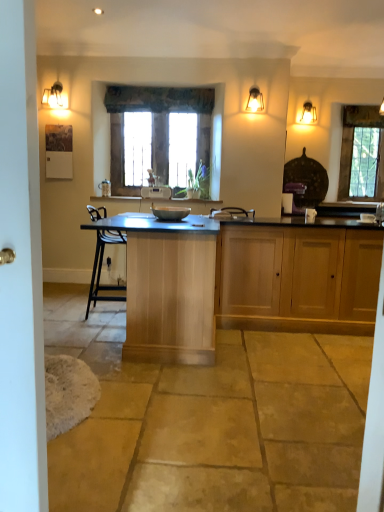
The width and height of the screenshot is (384, 512). Describe the element at coordinates (173, 137) in the screenshot. I see `wooden frame at center, the first window positioned from the left` at that location.

The height and width of the screenshot is (512, 384). Describe the element at coordinates (54, 97) in the screenshot. I see `matte brass sconce at upper left, which is the 2th light fixture from back to front` at that location.

Find the location of `matte black bowl at center`. matte black bowl at center is located at coordinates (170, 213).

What do you see at coordinates (298, 279) in the screenshot? The height and width of the screenshot is (512, 384). I see `wooden cabinet at center, the second cabinetry when ordered from left to right` at bounding box center [298, 279].

This screenshot has width=384, height=512. I want to click on satin nickel faucet at right, so click(x=380, y=213).

What do you see at coordinates (380, 213) in the screenshot? I see `satin nickel faucet at right` at bounding box center [380, 213].

Locate an element on the screen. wooden frame at center, which appears as the 2th window when viewed from the right is located at coordinates (173, 137).

Is wooden frame at center, marked as the 2th window in a back-to-front arrangement, to the left or to the right of light wood cabinet at center, acting as the second cabinetry starting from the right, in the image?

Clearly, wooden frame at center, marked as the 2th window in a back-to-front arrangement, is on the left of light wood cabinet at center, acting as the second cabinetry starting from the right, in the image.

Considering the sizes of objects wooden frame at center, the first window positioned from the left, and light wood cabinet at center, acting as the second cabinetry starting from the right, in the image provided, who is smaller, wooden frame at center, the first window positioned from the left, or light wood cabinet at center, acting as the second cabinetry starting from the right,?

Smaller between the two is wooden frame at center, the first window positioned from the left.

Is wooden frame at center, marked as the 2th window in a back-to-front arrangement, next to matte black bowl at center?

wooden frame at center, marked as the 2th window in a back-to-front arrangement, and matte black bowl at center are clearly separated.

From a real-world perspective, is wooden frame at center, the first window positioned from the left, located beneath matte black bowl at center?

No, from a real-world perspective, wooden frame at center, the first window positioned from the left, is not under matte black bowl at center.

From the image's perspective, between wooden frame at center, the first window positioned from the left, and matte black bowl at center, who is located below?

From the image's view, matte black bowl at center is below.

Between wooden frame at center, which appears as the 2th window when viewed from the right, and matte black bowl at center, which one has smaller size?

matte black bowl at center is smaller.

How many degrees apart are the facing directions of wooden cabinet at center, the second cabinetry when ordered from left to right, and matte brass sconce at upper left, which is the 2th light fixture from back to front?

The angular difference between wooden cabinet at center, the second cabinetry when ordered from left to right, and matte brass sconce at upper left, which is the 2th light fixture from back to front, is 1.49 degrees.

From the image's perspective, is wooden cabinet at center, the second cabinetry when ordered from left to right, positioned above or below matte brass sconce at upper left, which is the third light fixture from right to left?

From the image's perspective, wooden cabinet at center, the second cabinetry when ordered from left to right, appears below matte brass sconce at upper left, which is the third light fixture from right to left.

Is wooden cabinet at center, the second cabinetry when ordered from left to right, situated inside matte brass sconce at upper left, acting as the first light fixture starting from the left, or outside?

wooden cabinet at center, the second cabinetry when ordered from left to right, is not enclosed by matte brass sconce at upper left, acting as the first light fixture starting from the left.

The image size is (384, 512). There is a wooden cabinet at center, arranged as the 1th cabinetry when viewed from the right. In order to click on the 2nd light fixture above it (from a real-world perspective) in this screenshot , I will do `click(54, 97)`.

Between clear glass window at right, acting as the 2th window starting from the left, and matte brass light fixture at upper right, the 2th light fixture from the right, which one has larger size?

clear glass window at right, acting as the 2th window starting from the left.

Starting from the clear glass window at right, the 2th window in the front-to-back sequence, which light fixture is the 3rd one in front? Please provide its 2D coordinates.

[(255, 100)]

Is clear glass window at right, the 2th window in the front-to-back sequence, directly adjacent to matte brass light fixture at upper right, the 2th light fixture viewed from the left?

clear glass window at right, the 2th window in the front-to-back sequence, is not next to matte brass light fixture at upper right, the 2th light fixture viewed from the left, and they're not touching.

Considering the relative positions of clear glass window at right, the 1th window from the back, and matte brass light fixture at upper right, marked as the 1th light fixture in a front-to-back arrangement, in the image provided, is clear glass window at right, the 1th window from the back, behind matte brass light fixture at upper right, marked as the 1th light fixture in a front-to-back arrangement,?

Yes, clear glass window at right, the 1th window from the back, is behind matte brass light fixture at upper right, marked as the 1th light fixture in a front-to-back arrangement.

Is point (7, 501) closer or farther from the camera than point (354, 158)?

Point (7, 501) is positioned closer to the camera compared to point (354, 158).

Which object is wider, white glossy door at left or clear glass window at right, the 2th window in the front-to-back sequence?

white glossy door at left is wider.

Measure the distance from white glossy door at left to clear glass window at right, acting as the 2th window starting from the left.

A distance of 5.47 meters exists between white glossy door at left and clear glass window at right, acting as the 2th window starting from the left.

From the image's perspective, is white glossy door at left located above or below clear glass window at right, the 2th window in the front-to-back sequence?

From the image's perspective, white glossy door at left appears below clear glass window at right, the 2th window in the front-to-back sequence.

From a real-world perspective, is satin nickel faucet at right located higher than matte brass sconce at upper left, which is the 2th light fixture from back to front?

No.

Is point (383, 204) less distant than point (56, 96)?

Yes, it is in front of point (56, 96).

Which of these two, satin nickel faucet at right or matte brass sconce at upper left, which is the 2th light fixture from back to front, stands shorter?

satin nickel faucet at right is shorter.

Between satin nickel faucet at right and matte brass sconce at upper left, acting as the second light fixture starting from the front, which one appears on the left side from the viewer's perspective?

matte brass sconce at upper left, acting as the second light fixture starting from the front.

Are satin nickel faucet at right and wooden frame at center, the first window positioned from the left, making contact?

There is a gap between satin nickel faucet at right and wooden frame at center, the first window positioned from the left.

From a real-world perspective, is satin nickel faucet at right physically below wooden frame at center, the first window viewed from the front?

Yes, from a real-world perspective, satin nickel faucet at right is beneath wooden frame at center, the first window viewed from the front.

Is satin nickel faucet at right oriented towards wooden frame at center, marked as the 2th window in a back-to-front arrangement?

No, satin nickel faucet at right is not turned towards wooden frame at center, marked as the 2th window in a back-to-front arrangement.

This screenshot has width=384, height=512. Identify the location of the 1st window above the light wood cabinet at center, the 1th cabinetry when ordered from left to right (from a real-world perspective). (173, 137).

Locate an element on the screen. The image size is (384, 512). appliance lying below the wooden frame at center, the first window viewed from the front (from the image's perspective) is located at coordinates (170, 213).

Estimate the real-world distances between objects in this image. Which object is further from light wood cabinet at center, acting as the second cabinetry starting from the right, matte black bowl at center or clear glass window at right, the 2th window in the front-to-back sequence?

The object further to light wood cabinet at center, acting as the second cabinetry starting from the right, is clear glass window at right, the 2th window in the front-to-back sequence.

From the image, which object appears to be farther from matte brass sconce at upper left, which is the 2th light fixture from back to front, matte brass light fixture at upper right, the 2th light fixture viewed from the left, or light wood cabinet at center, the 1th cabinetry when ordered from left to right?

Based on the image, light wood cabinet at center, the 1th cabinetry when ordered from left to right, appears to be further to matte brass sconce at upper left, which is the 2th light fixture from back to front.

Estimate the real-world distances between objects in this image. Which object is closer to matte brass light fixture at upper right, the 2th light fixture from the right, clear glass window at right, which is the first window in right-to-left order, or matte black bowl at center?

matte black bowl at center.

Looking at this image, considering their positions, is clear glass window at right, the 2th window in the front-to-back sequence, positioned further to matte glass sconce at upper right, which is the third light fixture in front-to-back order, than matte brass sconce at upper left, which is the 2th light fixture from back to front?

Based on the image, matte brass sconce at upper left, which is the 2th light fixture from back to front, appears to be further to matte glass sconce at upper right, which is the third light fixture in front-to-back order.

From the image, which object appears to be farther from wooden cabinet at center, the second cabinetry when ordered from left to right, satin nickel faucet at right or clear glass window at right, acting as the 2th window starting from the left?

clear glass window at right, acting as the 2th window starting from the left.

Based on their spatial positions, is white glossy door at left or clear glass window at right, the 1th window from the back, further from wooden cabinet at center, arranged as the 1th cabinetry when viewed from the right?

The object further to wooden cabinet at center, arranged as the 1th cabinetry when viewed from the right, is white glossy door at left.

Which object lies further to the anchor point wooden cabinet at center, the second cabinetry when ordered from left to right, matte brass sconce at upper left, which is the 2th light fixture from back to front, or matte black bowl at center?

matte brass sconce at upper left, which is the 2th light fixture from back to front.

Estimate the real-world distances between objects in this image. Which object is closer to light wood cabinet at center, the 1th cabinetry when ordered from left to right, wooden frame at center, which appears as the 2th window when viewed from the right, or matte glass sconce at upper right, positioned as the 1th light fixture in back-to-front order?

wooden frame at center, which appears as the 2th window when viewed from the right, is positioned closer to the anchor light wood cabinet at center, the 1th cabinetry when ordered from left to right.

Identify the location of window between matte brass sconce at upper left, which is the third light fixture from right to left, and satin nickel faucet at right, in the horizontal direction. This screenshot has width=384, height=512. coord(173,137).

Where is `appliance between matte brass sconce at upper left, acting as the first light fixture starting from the left, and light wood cabinet at center, acting as the second cabinetry starting from the right, in the up-down direction`? Image resolution: width=384 pixels, height=512 pixels. appliance between matte brass sconce at upper left, acting as the first light fixture starting from the left, and light wood cabinet at center, acting as the second cabinetry starting from the right, in the up-down direction is located at coordinates (170, 213).

Locate an element on the screen. The image size is (384, 512). appliance positioned between white glossy door at left and wooden cabinet at center, arranged as the 1th cabinetry when viewed from the right, from near to far is located at coordinates (170, 213).

I want to click on appliance located between white glossy door at left and wooden frame at center, the first window viewed from the front, in the depth direction, so click(x=170, y=213).